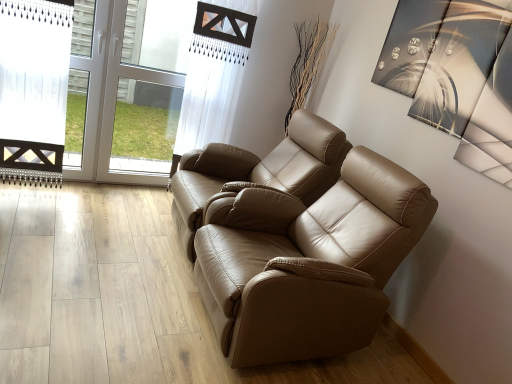
The image size is (512, 384). What are the coordinates of `free space between tan leather sofa at center, arranged as the second chair when viewed from the front, and tan leather sofa at center, which is the second chair in back-to-front order` in the screenshot? It's located at (167, 261).